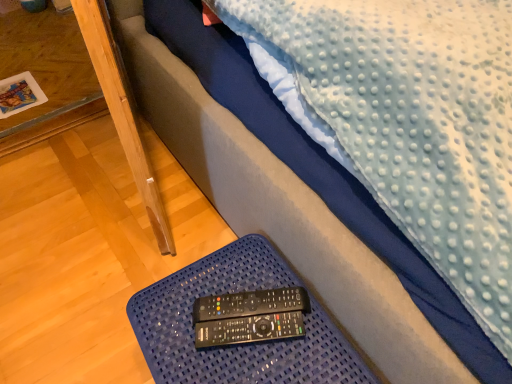
You are a GUI agent. You are given a task and a screenshot of the screen. Output one action in this format:
    pyautogui.click(x=<x>, y=<y>)
    Task: Click on the free location in front of black plastic remote at lower center, which is counted as the second control, starting from the front
    
    Given the screenshot: What is the action you would take?
    pyautogui.click(x=257, y=364)